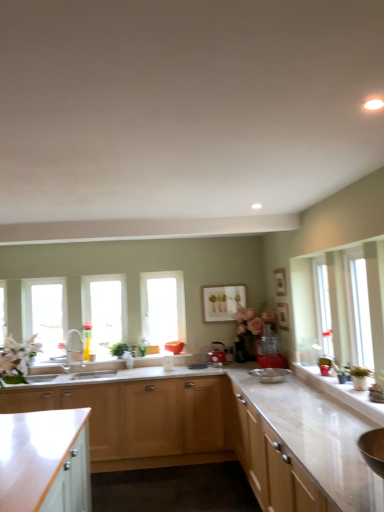
Question: From the image's perspective, is white marble countertop at lower center beneath metallic red kettle at center, which is the first appliance in left-to-right order?

Choices:
 (A) no
 (B) yes

Answer: (B)

Question: Can you confirm if white marble countertop at lower center is bigger than metallic red kettle at center, which is the first appliance in left-to-right order?

Choices:
 (A) no
 (B) yes

Answer: (B)

Question: Can you confirm if white marble countertop at lower center is wider than metallic red kettle at center, the 2th appliance positioned from the front?

Choices:
 (A) yes
 (B) no

Answer: (A)

Question: From a real-world perspective, is white marble countertop at lower center positioned over metallic red kettle at center, which is the first appliance in left-to-right order, based on gravity?

Choices:
 (A) no
 (B) yes

Answer: (A)

Question: Is the position of white marble countertop at lower center less distant than that of metallic red kettle at center, which is the first appliance in left-to-right order?

Choices:
 (A) no
 (B) yes

Answer: (B)

Question: Is white glossy counter top at right in front of or behind light wood cabinet at lower center, acting as the second cabinetry starting from the left, in the image?

Choices:
 (A) behind
 (B) front

Answer: (B)

Question: From the image's perspective, is white glossy counter top at right positioned above or below light wood cabinet at lower center, which is the 2th cabinetry in right-to-left order?

Choices:
 (A) above
 (B) below

Answer: (A)

Question: Is white glossy counter top at right taller or shorter than light wood cabinet at lower center, acting as the second cabinetry starting from the left?

Choices:
 (A) tall
 (B) short

Answer: (B)

Question: Does point (337, 381) appear closer or farther from the camera than point (1, 396)?

Choices:
 (A) farther
 (B) closer

Answer: (B)

Question: Considering the positions of transparent glass window at center, the first window positioned from the right, and clear glass window at center, the second window when ordered from left to right, in the image, is transparent glass window at center, the first window positioned from the right, taller or shorter than clear glass window at center, the second window when ordered from left to right,?

Choices:
 (A) tall
 (B) short

Answer: (A)

Question: Does point (160, 278) appear closer or farther from the camera than point (104, 322)?

Choices:
 (A) closer
 (B) farther

Answer: (A)

Question: Is transparent glass window at center, the first window positioned from the right, in front of or behind clear glass window at center, the second window when ordered from left to right, in the image?

Choices:
 (A) behind
 (B) front

Answer: (A)

Question: From a real-world perspective, is transparent glass window at center, which ranks as the third window in left-to-right order, physically located above or below clear glass window at center, the 2th window from the right?

Choices:
 (A) below
 (B) above

Answer: (B)

Question: Considering the positions of red plastic blender at center, acting as the second appliance starting from the back, and matte white picture frame at center in the image, is red plastic blender at center, acting as the second appliance starting from the back, wider or thinner than matte white picture frame at center?

Choices:
 (A) wide
 (B) thin

Answer: (A)

Question: Considering the relative positions of red plastic blender at center, acting as the second appliance starting from the back, and matte white picture frame at center in the image provided, is red plastic blender at center, acting as the second appliance starting from the back, to the left or to the right of matte white picture frame at center?

Choices:
 (A) left
 (B) right

Answer: (B)